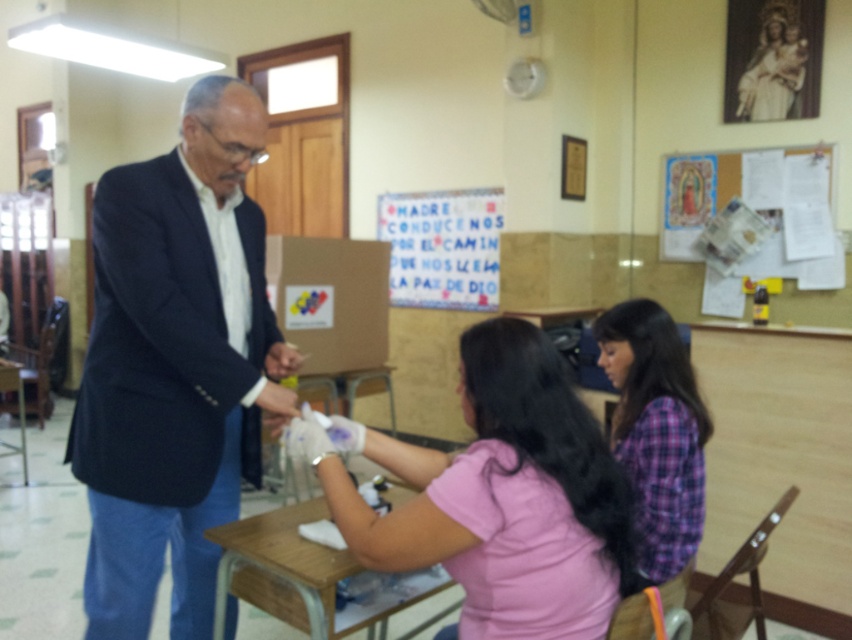
You are organizing a community event and need to ensure all items on the wooden table at center are visible. Is the purple plaid shirt at lower right currently blocking any items on the table?

The purple plaid shirt at lower right is positioned over the wooden table at center, so it is likely blocking some items on the table.

You are a delivery robot with a height of 1.5 meters. You need to deliver a package to the purple plaid shirt at lower right. Can you reach the person without bending down?

The distance of purple plaid shirt at lower right from viewer is 1.43 meters, so the robot can reach them without bending down since the distance is less than its height.